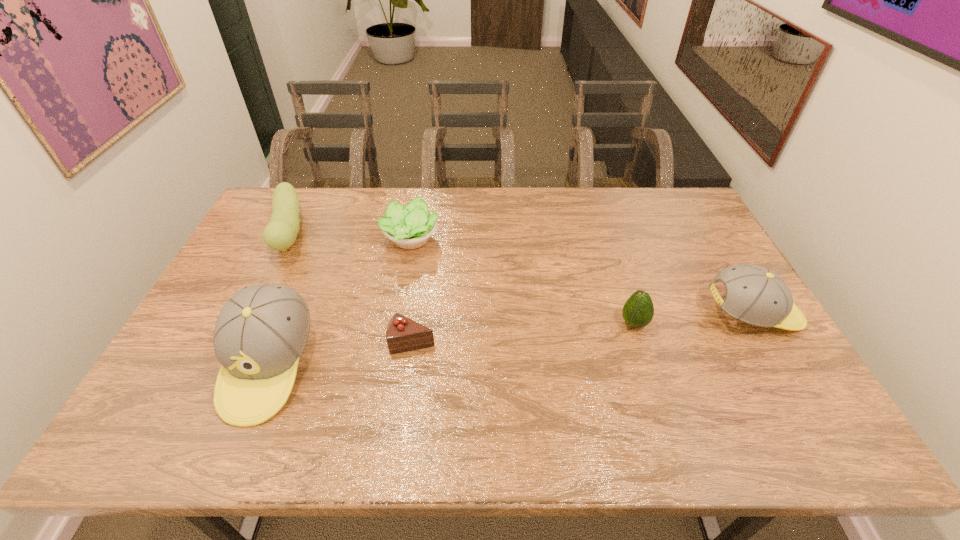
The image size is (960, 540). In the image, there is a desktop. What are the coordinates of `vacant space at the far edge` in the screenshot? It's located at (447, 192).

What are the coordinates of `vacant space at the right edge` in the screenshot? It's located at (775, 345).

What are the coordinates of `empty space that is in between the shortest object and the taller baseball cap` in the screenshot? It's located at (341, 354).

You are a GUI agent. You are given a task and a screenshot of the screen. Output one action in this format:
    pyautogui.click(x=<x>, y=<y>)
    Task: Click on the vacant area that lies between the shorter baseball cap and the chocolate cake
    Image resolution: width=960 pixels, height=540 pixels.
    Given the screenshot: What is the action you would take?
    pyautogui.click(x=583, y=328)

In order to click on unoccupied area between the chocolate cake and the right baseball cap in this screenshot , I will do `click(583, 328)`.

The width and height of the screenshot is (960, 540). I want to click on free area in between the second tallest object and the avocado, so [x=693, y=319].

Where is `vacant region between the taller baseball cap and the fifth shortest object`? vacant region between the taller baseball cap and the fifth shortest object is located at coordinates (511, 340).

Find the location of `free space between the lettuce and the shortest object`. free space between the lettuce and the shortest object is located at coordinates (412, 291).

Where is `empty space between the cucumber and the shortest object`? The image size is (960, 540). empty space between the cucumber and the shortest object is located at coordinates (351, 287).

The height and width of the screenshot is (540, 960). Find the location of `free spot between the shortest object and the tallest object`. free spot between the shortest object and the tallest object is located at coordinates (341, 354).